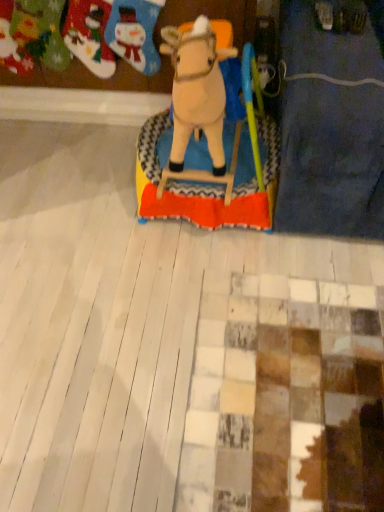
Question: Is felt stocking at upper left, which is the 2th toy from left to right, surrounded by felt stockings at upper left, placed as the third toy when sorted from right to left?

Choices:
 (A) yes
 (B) no

Answer: (B)

Question: Is felt stockings at upper left, placed as the first toy when sorted from left to right, oriented away from felt stocking at upper left, arranged as the second toy when viewed from the right?

Choices:
 (A) no
 (B) yes

Answer: (A)

Question: Is felt stockings at upper left, placed as the third toy when sorted from right to left, further to camera compared to felt stocking at upper left, which is the 2th toy from left to right?

Choices:
 (A) no
 (B) yes

Answer: (B)

Question: Does felt stockings at upper left, placed as the first toy when sorted from left to right, appear on the left side of felt stocking at upper left, which is the 2th toy from left to right?

Choices:
 (A) yes
 (B) no

Answer: (A)

Question: From a real-world perspective, is felt stockings at upper left, placed as the first toy when sorted from left to right, physically below felt stocking at upper left, arranged as the second toy when viewed from the right?

Choices:
 (A) yes
 (B) no

Answer: (A)

Question: From their relative heights in the image, would you say felt stocking at upper left, which is the 2th toy from left to right, is taller or shorter than beige plush horse at center, which appears as the first toy when viewed from the right?

Choices:
 (A) tall
 (B) short

Answer: (B)

Question: Is felt stocking at upper left, which is the 2th toy from left to right, inside the boundaries of beige plush horse at center, which appears as the first toy when viewed from the right, or outside?

Choices:
 (A) outside
 (B) inside

Answer: (A)

Question: Considering the positions of felt stocking at upper left, arranged as the second toy when viewed from the right, and beige plush horse at center, the 3th toy in the left-to-right sequence, in the image, is felt stocking at upper left, arranged as the second toy when viewed from the right, bigger or smaller than beige plush horse at center, the 3th toy in the left-to-right sequence,?

Choices:
 (A) big
 (B) small

Answer: (B)

Question: From a real-world perspective, is felt stocking at upper left, arranged as the second toy when viewed from the right, above or below beige plush horse at center, which appears as the first toy when viewed from the right?

Choices:
 (A) above
 (B) below

Answer: (B)

Question: Is beige plush horse at center, the 3th toy in the left-to-right sequence, bigger or smaller than felt stockings at upper left, placed as the first toy when sorted from left to right?

Choices:
 (A) big
 (B) small

Answer: (A)

Question: Considering the relative positions of beige plush horse at center, the 3th toy in the left-to-right sequence, and felt stockings at upper left, placed as the third toy when sorted from right to left, in the image provided, is beige plush horse at center, the 3th toy in the left-to-right sequence, to the left or to the right of felt stockings at upper left, placed as the third toy when sorted from right to left,?

Choices:
 (A) left
 (B) right

Answer: (B)

Question: In the image, is beige plush horse at center, the 3th toy in the left-to-right sequence, positioned in front of or behind felt stockings at upper left, placed as the third toy when sorted from right to left?

Choices:
 (A) behind
 (B) front

Answer: (B)

Question: Would you say beige plush horse at center, which appears as the first toy when viewed from the right, is inside or outside felt stockings at upper left, placed as the third toy when sorted from right to left?

Choices:
 (A) outside
 (B) inside

Answer: (A)

Question: Is felt stocking at upper left, arranged as the second toy when viewed from the right, wider or thinner than felt stockings at upper left, placed as the first toy when sorted from left to right?

Choices:
 (A) wide
 (B) thin

Answer: (B)

Question: Based on their positions, is felt stocking at upper left, which is the 2th toy from left to right, located to the left or right of felt stockings at upper left, placed as the first toy when sorted from left to right?

Choices:
 (A) left
 (B) right

Answer: (B)